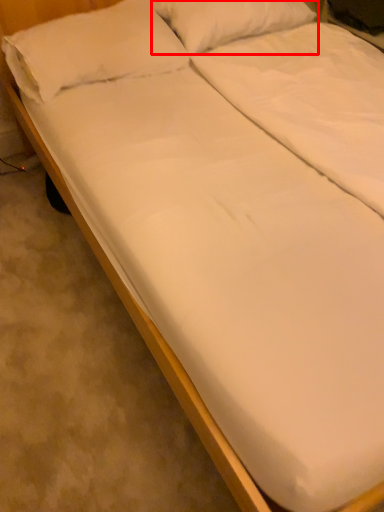
Question: From the image, what is the correct spatial relationship of pillow (annotated by the red box) in relation to pillow?

Choices:
 (A) left
 (B) right

Answer: (B)